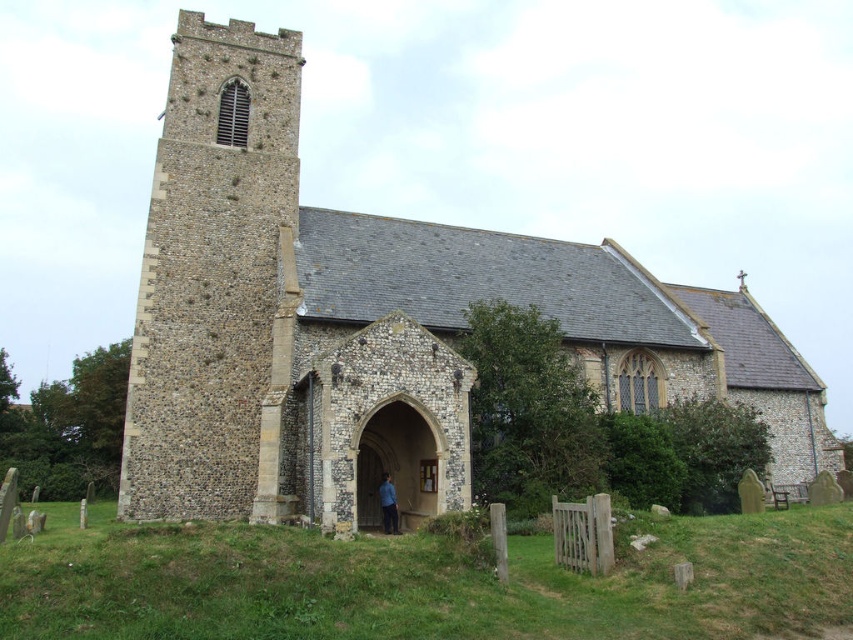
Can you confirm if stone church at center is bigger than blue fabric at center?

Yes.

This screenshot has width=853, height=640. I want to click on stone church at center, so click(372, 321).